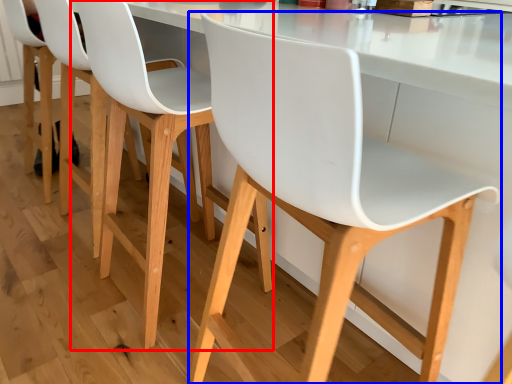
Question: Which point is closer to the camera, chair (highlighted by a red box) or chair (highlighted by a blue box)?

Choices:
 (A) chair
 (B) chair

Answer: (B)